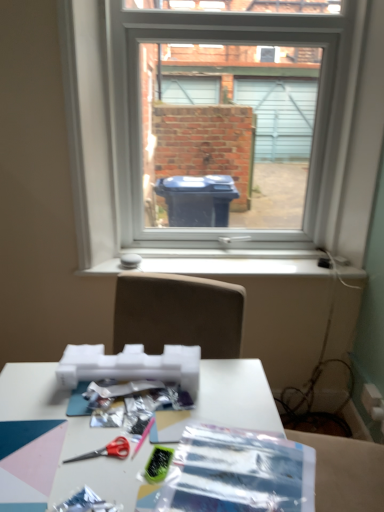
Identify the location of free space above white matte table at lower center (from a real-world perspective). (120, 421).